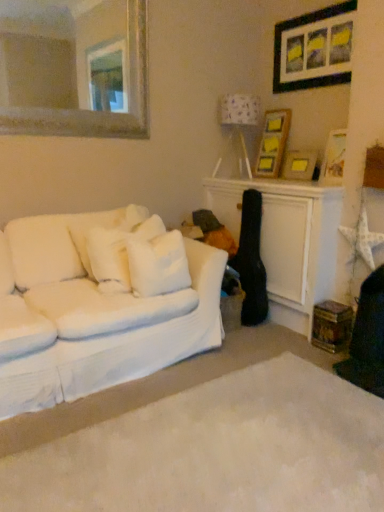
Question: Should I look upward or downward to see white fabric couch at left?

Choices:
 (A) down
 (B) up

Answer: (A)

Question: Is wooden picture frame at upper right, the first picture frame positioned from the bottom, turned away from black matte picture frame at upper right, which ranks as the first picture frame in top-to-bottom order?

Choices:
 (A) yes
 (B) no

Answer: (B)

Question: Is wooden picture frame at upper right, the first picture frame positioned from the bottom, to the left of black matte picture frame at upper right, which ranks as the first picture frame in top-to-bottom order, from the viewer's perspective?

Choices:
 (A) yes
 (B) no

Answer: (A)

Question: From the image's perspective, does wooden picture frame at upper right, the first picture frame positioned from the bottom, appear lower than black matte picture frame at upper right, which ranks as the first picture frame in top-to-bottom order?

Choices:
 (A) no
 (B) yes

Answer: (B)

Question: From a real-world perspective, does wooden picture frame at upper right, the first picture frame positioned from the bottom, sit lower than black matte picture frame at upper right, which ranks as the first picture frame in top-to-bottom order?

Choices:
 (A) no
 (B) yes

Answer: (B)

Question: Considering the relative sizes of wooden picture frame at upper right, the first picture frame positioned from the bottom, and black matte picture frame at upper right, which ranks as the fourth picture frame in bottom-to-top order, in the image provided, is wooden picture frame at upper right, the first picture frame positioned from the bottom, smaller than black matte picture frame at upper right, which ranks as the fourth picture frame in bottom-to-top order,?

Choices:
 (A) yes
 (B) no

Answer: (A)

Question: Considering the relative sizes of wooden picture frame at upper right, the first picture frame positioned from the bottom, and black matte picture frame at upper right, which ranks as the fourth picture frame in bottom-to-top order, in the image provided, is wooden picture frame at upper right, the first picture frame positioned from the bottom, shorter than black matte picture frame at upper right, which ranks as the fourth picture frame in bottom-to-top order,?

Choices:
 (A) yes
 (B) no

Answer: (A)

Question: Can you confirm if white fabric lampshade at upper right is taller than gold-framed mirror at upper left?

Choices:
 (A) yes
 (B) no

Answer: (B)

Question: From the image's perspective, is white fabric lampshade at upper right below gold-framed mirror at upper left?

Choices:
 (A) no
 (B) yes

Answer: (B)

Question: Does white fabric lampshade at upper right have a greater width compared to gold-framed mirror at upper left?

Choices:
 (A) no
 (B) yes

Answer: (B)

Question: Is white fabric lampshade at upper right further to the viewer compared to gold-framed mirror at upper left?

Choices:
 (A) yes
 (B) no

Answer: (A)

Question: Is white fabric lampshade at upper right outside of gold-framed mirror at upper left?

Choices:
 (A) yes
 (B) no

Answer: (A)

Question: Considering the relative sizes of white fabric lampshade at upper right and gold-framed mirror at upper left in the image provided, is white fabric lampshade at upper right bigger than gold-framed mirror at upper left?

Choices:
 (A) yes
 (B) no

Answer: (B)

Question: Does white soft pillow at left, acting as the first pillow starting from the left, come behind white fabric lampshade at upper right?

Choices:
 (A) yes
 (B) no

Answer: (B)